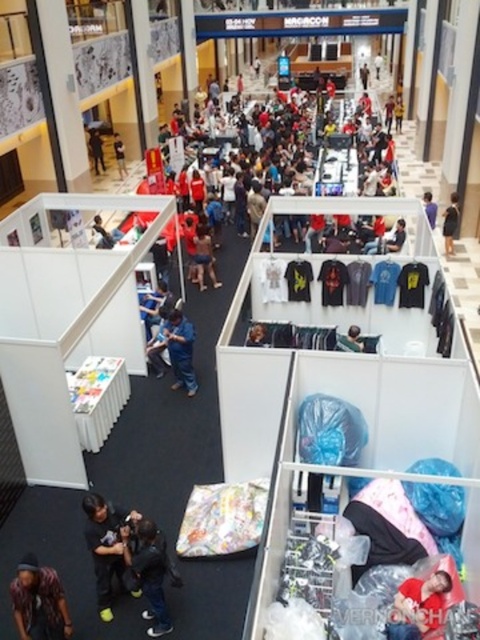
Question: Does black matte jacket at lower left have a greater width compared to black fabric shirt at center?

Choices:
 (A) no
 (B) yes

Answer: (A)

Question: Which of the following is the farthest from the observer?

Choices:
 (A) blue jeans at center
 (B) black matte jacket at lower left
 (C) light brown leather jacket at lower right

Answer: (A)

Question: Based on their relative distances, which object is farther from the blue jeans at center?

Choices:
 (A) matte blue shirt at center
 (B) black fabric shirt at center

Answer: (A)

Question: Does dark gray hoodie at center have a smaller size compared to black fabric shirt at center?

Choices:
 (A) no
 (B) yes

Answer: (B)

Question: Does black matte jacket at lower left come behind dark gray hoodie at center?

Choices:
 (A) no
 (B) yes

Answer: (B)

Question: Which object appears closest to the camera in this image?

Choices:
 (A) light brown leather jacket at lower right
 (B) multicolored hair at lower left
 (C) matte blue shirt at center

Answer: (A)